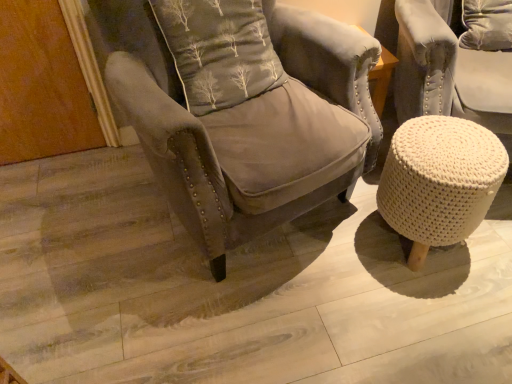
Describe the element at coordinates (439, 181) in the screenshot. I see `white knitted stool at lower right` at that location.

You are a GUI agent. You are given a task and a screenshot of the screen. Output one action in this format:
    pyautogui.click(x=<x>, y=<y>)
    Task: Click on the velvet gray armchair at center
    The height and width of the screenshot is (384, 512).
    Given the screenshot: What is the action you would take?
    240,109

I want to click on gray fabric pillow at center, so click(x=219, y=51).

Locate an element on the screen. Image resolution: width=512 pixels, height=384 pixels. white knitted stool at lower right is located at coordinates (439, 181).

From their relative heights in the image, would you say velvet gray armchair at center is taller or shorter than white knitted stool at lower right?

In the image, velvet gray armchair at center appears to be taller than white knitted stool at lower right.

Is point (179, 73) positioned after point (482, 135)?

Yes, it is behind point (482, 135).

How distant is velvet gray armchair at center from white knitted stool at lower right?

A distance of 14.43 inches exists between velvet gray armchair at center and white knitted stool at lower right.

Would you say velvet gray armchair at center is to the left or to the right of white knitted stool at lower right in the picture?

In the image, velvet gray armchair at center appears on the left side of white knitted stool at lower right.

I want to click on bar stool behind the gray fabric pillow at center, so click(439, 181).

Is point (204, 29) closer or farther from the camera than point (467, 131)?

Point (204, 29) is farther from the camera than point (467, 131).

Is gray fabric pillow at center in front of white knitted stool at lower right?

Yes, gray fabric pillow at center is closer to the viewer.

Considering the relative sizes of gray fabric pillow at center and white knitted stool at lower right in the image provided, is gray fabric pillow at center smaller than white knitted stool at lower right?

No, gray fabric pillow at center is not smaller than white knitted stool at lower right.

From the image's perspective, does gray fabric pillow at center appear lower than velvet gray armchair at center?

No, from the image's perspective, gray fabric pillow at center is not beneath velvet gray armchair at center.

Does gray fabric pillow at center lie behind velvet gray armchair at center?

Yes, the depth of gray fabric pillow at center is greater than that of velvet gray armchair at center.

You are a GUI agent. You are given a task and a screenshot of the screen. Output one action in this format:
    pyautogui.click(x=<x>, y=<y>)
    Task: Click on the chair in front of the gray fabric pillow at center
    This screenshot has width=512, height=384.
    Given the screenshot: What is the action you would take?
    pyautogui.click(x=240, y=109)

In terms of width, does velvet gray armchair at center look wider or thinner when compared to gray fabric pillow at center?

velvet gray armchair at center is wider than gray fabric pillow at center.

Considering the relative positions of velvet gray armchair at center and gray fabric pillow at center in the image provided, is velvet gray armchair at center to the left of gray fabric pillow at center from the viewer's perspective?

No, velvet gray armchair at center is not to the left of gray fabric pillow at center.

Which of these two, velvet gray armchair at center or gray fabric pillow at center, is bigger?

velvet gray armchair at center is bigger.

Where is `chair on the right of gray fabric pillow at center`? chair on the right of gray fabric pillow at center is located at coordinates click(x=240, y=109).

Between white knitted stool at lower right and gray fabric pillow at center, which one appears on the right side from the viewer's perspective?

Positioned to the right is white knitted stool at lower right.

Can you confirm if white knitted stool at lower right is thinner than gray fabric pillow at center?

No.

You are a GUI agent. You are given a task and a screenshot of the screen. Output one action in this format:
    pyautogui.click(x=<x>, y=<y>)
    Task: Click on the pillow that is in front of the white knitted stool at lower right
    This screenshot has height=384, width=512.
    Given the screenshot: What is the action you would take?
    pyautogui.click(x=219, y=51)

Which of these two, white knitted stool at lower right or gray fabric pillow at center, stands taller?

gray fabric pillow at center is taller.

Does point (420, 254) come closer to viewer compared to point (260, 46)?

No.

Is white knitted stool at lower right with velvet gray armchair at center?

No, white knitted stool at lower right is not next to velvet gray armchair at center.

In the image, is white knitted stool at lower right on the left side or the right side of velvet gray armchair at center?

white knitted stool at lower right is positioned on velvet gray armchair at center's right side.

How many degrees apart are the facing directions of white knitted stool at lower right and velvet gray armchair at center?

There is a 23.7-degree angle between the facing directions of white knitted stool at lower right and velvet gray armchair at center.

This screenshot has width=512, height=384. I want to click on chair located above the white knitted stool at lower right (from the image's perspective), so click(x=240, y=109).

At what (x,y) coordinates should I click in order to perform the action: click on bar stool below the gray fabric pillow at center (from a real-world perspective). Please return your answer as a coordinate pair (x, y). Looking at the image, I should click on (439, 181).

Considering their positions, is white knitted stool at lower right positioned further to gray fabric pillow at center than velvet gray armchair at center?

white knitted stool at lower right is further to gray fabric pillow at center.

Based on the photo, considering their positions, is white knitted stool at lower right positioned further to velvet gray armchair at center than gray fabric pillow at center?

white knitted stool at lower right is positioned further to the anchor velvet gray armchair at center.

Consider the image. Based on their spatial positions, is velvet gray armchair at center or white knitted stool at lower right closer to gray fabric pillow at center?

Among the two, velvet gray armchair at center is located nearer to gray fabric pillow at center.

Which object lies further to the anchor point velvet gray armchair at center, gray fabric pillow at center or white knitted stool at lower right?

Among the two, white knitted stool at lower right is located further to velvet gray armchair at center.

Considering their positions, is gray fabric pillow at center positioned further to white knitted stool at lower right than velvet gray armchair at center?

The object further to white knitted stool at lower right is gray fabric pillow at center.

Based on their spatial positions, is velvet gray armchair at center or gray fabric pillow at center further from white knitted stool at lower right?

gray fabric pillow at center.

At what (x,y) coordinates should I click in order to perform the action: click on chair located between gray fabric pillow at center and white knitted stool at lower right in the left-right direction. Please return your answer as a coordinate pair (x, y). The image size is (512, 384). Looking at the image, I should click on (240, 109).